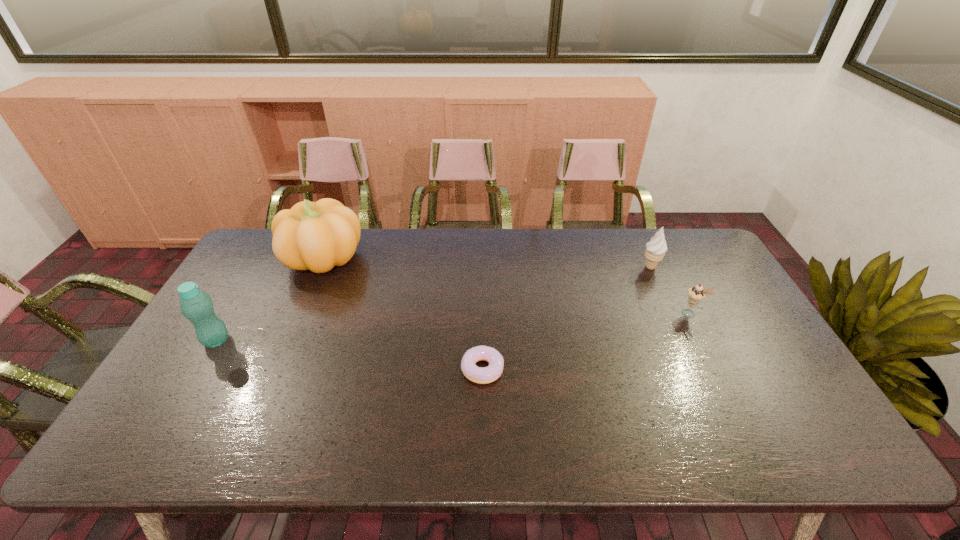
The height and width of the screenshot is (540, 960). Find the location of `the fourth object from right to left`. the fourth object from right to left is located at coordinates (316, 236).

This screenshot has width=960, height=540. I want to click on water bottle, so click(196, 306).

I want to click on the second nearest object, so click(x=196, y=306).

Locate an element on the screen. The height and width of the screenshot is (540, 960). the taller icecream is located at coordinates (655, 249).

The width and height of the screenshot is (960, 540). In order to click on the third tallest object in this screenshot , I will do `click(655, 249)`.

Identify the location of the third farthest object. The width and height of the screenshot is (960, 540). (696, 294).

Find the location of a particular element. Image resolution: width=960 pixels, height=540 pixels. the second shortest object is located at coordinates (696, 294).

Find the location of a particular element. The image size is (960, 540). doughnut is located at coordinates (482, 375).

Identify the location of the shortest object. This screenshot has width=960, height=540. tap(482, 375).

Where is `vacant space located on the front of the fourth object from right to left`? The width and height of the screenshot is (960, 540). vacant space located on the front of the fourth object from right to left is located at coordinates (306, 295).